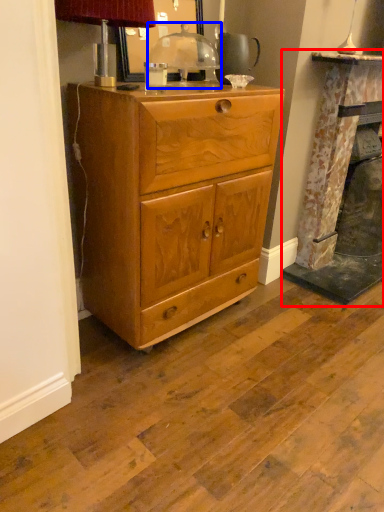
Question: Which point is closer to the camera, fireplace (highlighted by a red box) or table lamp (highlighted by a blue box)?

Choices:
 (A) fireplace
 (B) table lamp

Answer: (B)